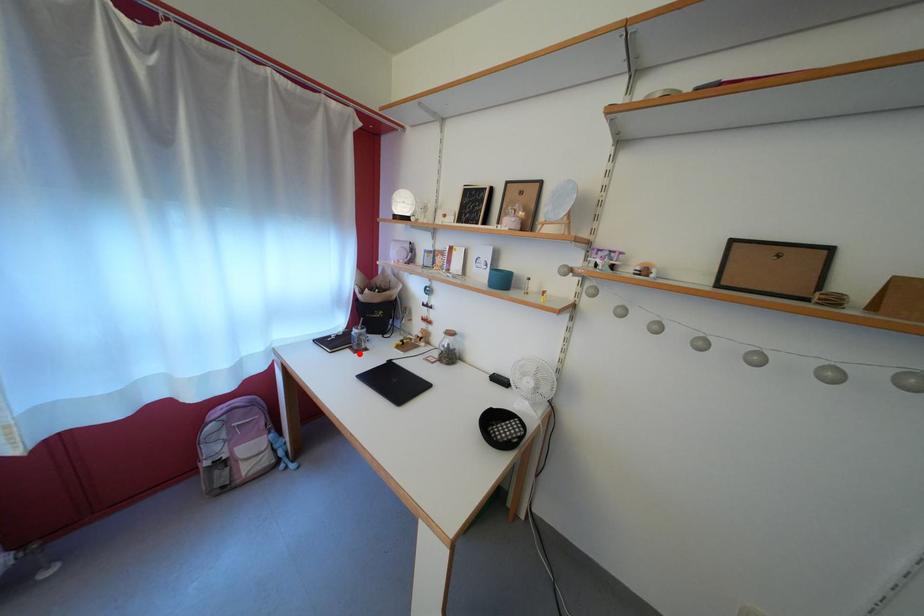
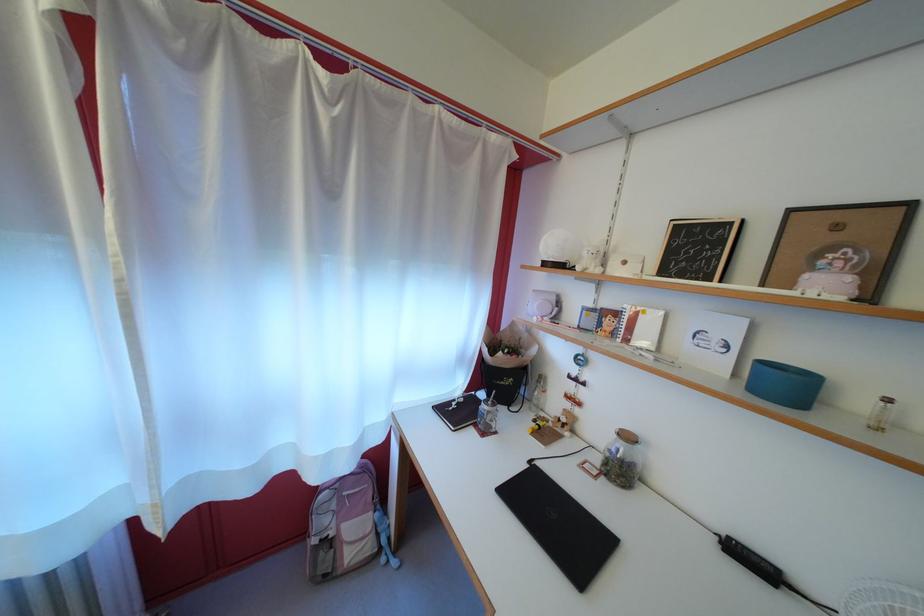
Question: I am providing you with two images of the same scene from different viewpoints. A red point is marked on the first image. Is the red point's position out of view in image 2?

Choices:
 (A) Yes
 (B) No

Answer: (B)